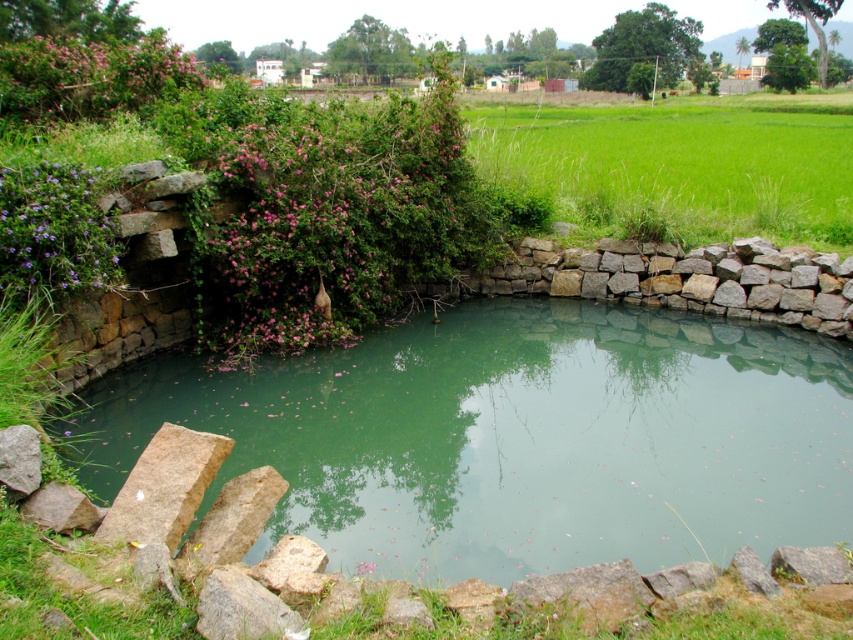
You are a landscape architect designing a pathway that must pass between the green stone water at center and the natural stone wall at right. The pathway needs to be 2 meters wide. Is there enough space between them for this pathway?

The green stone water at center is wider than the natural stone wall at right. Since the pathway requires 2 meters, but the description only states which is wider, not the exact distance between them, it is unclear if there is sufficient space. More information about the distance between them is needed to determine feasibility.

You are standing at the center of the pond and want to reach the gray rough rock at lower left without stepping on the natural stone wall at right. Which direction should you move?

You should move to the left because the natural stone wall at right is to the right of the gray rough rock at lower left, so moving left will take you away from the wall and towards the gray rough rock at lower left.